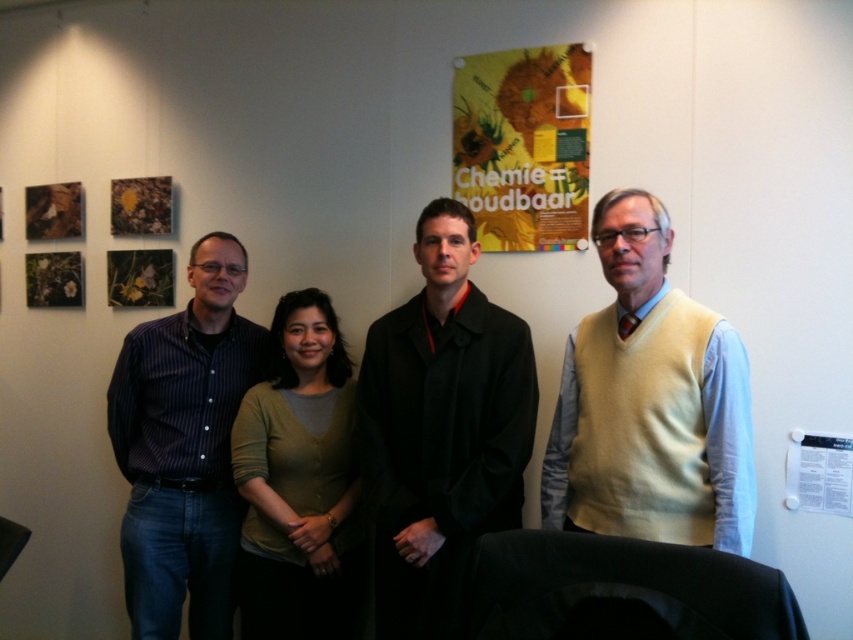
You are organizing a photo shoot and need to position the yellow sweater vest at right and black matte coat at center according to their current positions. Which clothing item is positioned further to the right?

The yellow sweater vest at right is positioned further to the right compared to the black matte coat at center, as it is stated that the yellow sweater vest at right is to the right of the black matte coat at center.

You are a photographer positioned in front of the scene. You notice the black matte coat at center and the yellow paper poster at upper center. Which object is nearer to you?

The black matte coat at center is closer to the viewer than the yellow paper poster at upper center.

You are organizing a charity event and need to decide which clothing item to feature in the promotional material. Based on the image, which clothing item is shorter in height between the yellow sweater vest at right and the black matte coat at center?

The yellow sweater vest at right has a lesser height compared to the black matte coat at center, so the yellow sweater vest at right is shorter in height.